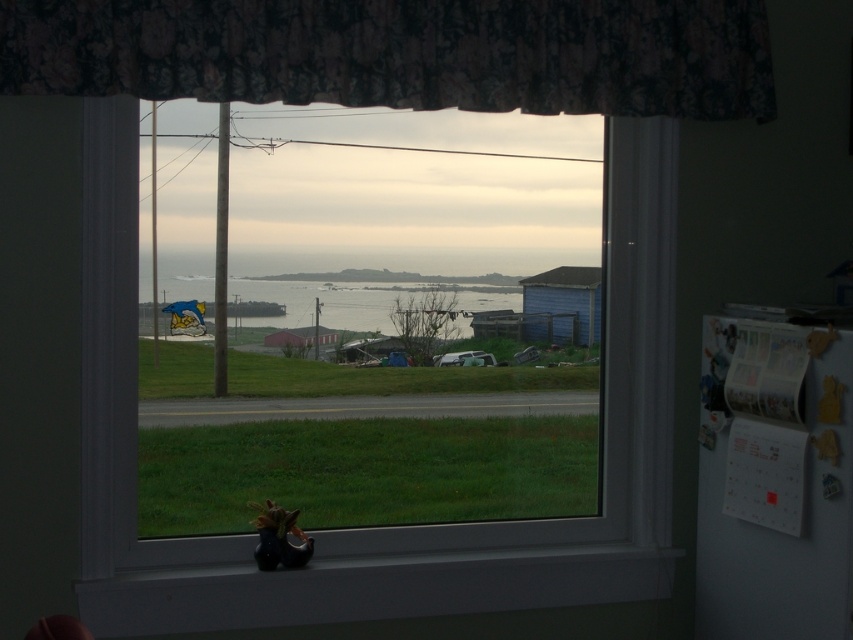
Question: Observing the image, what is the correct spatial positioning of floral fabric curtain at upper center in reference to transparent glass window at center?

Choices:
 (A) left
 (B) right

Answer: (B)

Question: Which point is closer to the camera?

Choices:
 (A) (595, 550)
 (B) (619, 16)
 (C) (207, 298)
 (D) (360, 612)

Answer: (D)

Question: Does floral fabric curtain at upper center appear under black matte window sill at lower center?

Choices:
 (A) no
 (B) yes

Answer: (A)

Question: Which point appears farthest from the camera in this image?

Choices:
 (A) (239, 284)
 (B) (103, 58)

Answer: (A)

Question: Does transparent glass window at center have a larger size compared to black matte window sill at lower center?

Choices:
 (A) no
 (B) yes

Answer: (B)

Question: Which point is farther to the camera?

Choices:
 (A) (368, 77)
 (B) (94, 266)
 (C) (370, 586)
 (D) (167, 332)

Answer: (D)